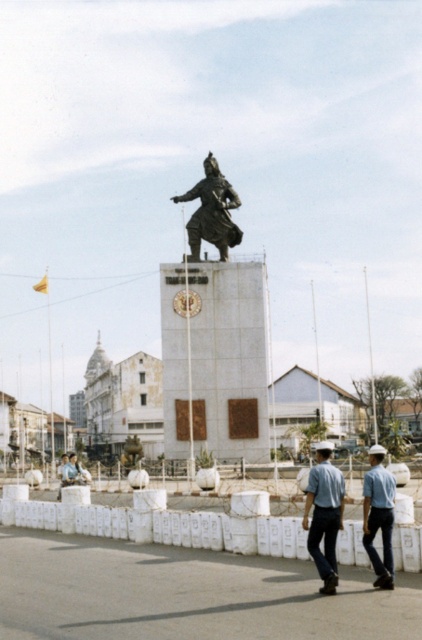
You are a delivery person carrying a large package that is 3 meters wide. You need to place it between the white plastic bags at center and the blue uniform at lower center. Is there enough space to fit the package without moving either object?

The distance between the white plastic bags at center and the blue uniform at lower center is 3.23 meters. Since the package is 3 meters wide, there is enough space to place it between them without moving either object.

You are a delivery person who needs to place a package at the statue. The statue is on a tall pedestal surrounded by a barrier with barbed wire. There is a point marked at coordinates (192, 529) where white plastic bags are located. Can you safely place the package near the statue without crossing the barrier? Please explain your reasoning.

The point at (192, 529) with white plastic bags at center is located near the barrier surrounding the statue. Since the barrier has barbed wire, it is likely restricted access. To safely place the package near the statue without crossing the barrier, you would need to check if the marked point is outside the barrier. If the white plastic bags are at the center of the square, they might be outside the restricted area. However, without specific clearance, crossing the barrier could be dangerous or against